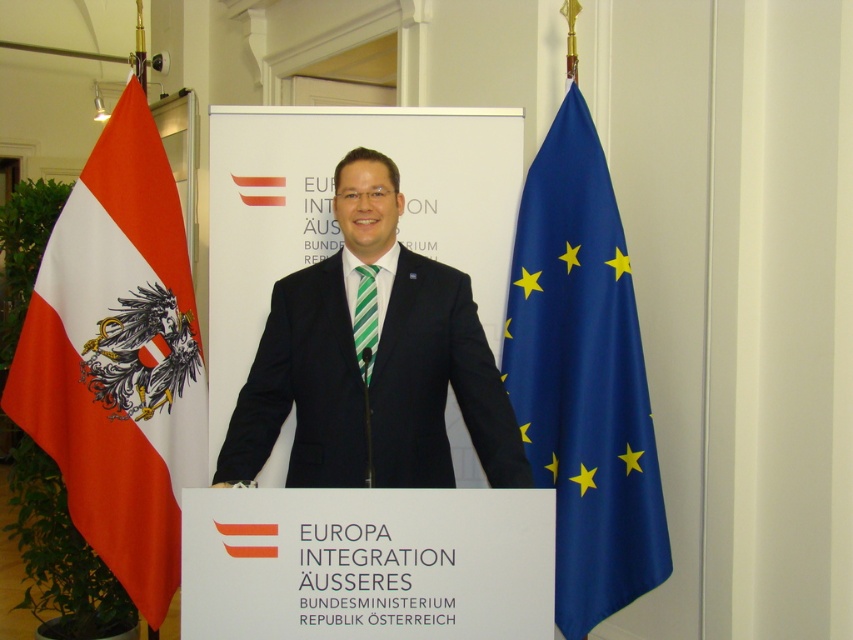
Question: Estimate the real-world distances between objects in this image. Which object is closer to the blue satin flag at right?

Choices:
 (A) green striped tie at center
 (B) black suit at center
 (C) red-white fabric flag at left

Answer: (B)

Question: From the image, what is the correct spatial relationship of black suit at center in relation to blue satin flag at right?

Choices:
 (A) below
 (B) above

Answer: (B)

Question: Estimate the real-world distances between objects in this image. Which object is farther from the blue satin flag at right?

Choices:
 (A) red-white fabric flag at left
 (B) green striped tie at center

Answer: (A)

Question: Which of the following is the closest to the observer?

Choices:
 (A) (508, 317)
 (B) (149, 452)
 (C) (364, 340)

Answer: (C)

Question: Can you confirm if red-white fabric flag at left is positioned above black suit at center?

Choices:
 (A) no
 (B) yes

Answer: (A)

Question: Is black suit at center thinner than blue satin flag at right?

Choices:
 (A) yes
 (B) no

Answer: (B)